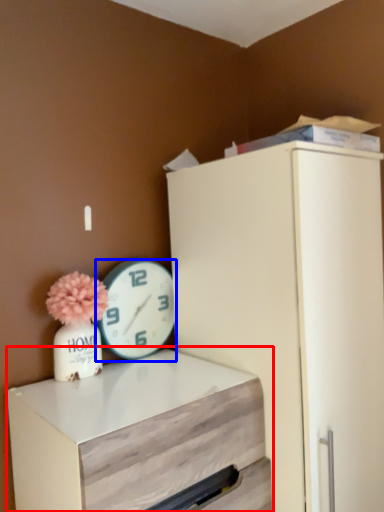
Question: Which point is further to the camera, chest of drawers (highlighted by a red box) or wall clock (highlighted by a blue box)?

Choices:
 (A) chest of drawers
 (B) wall clock

Answer: (B)